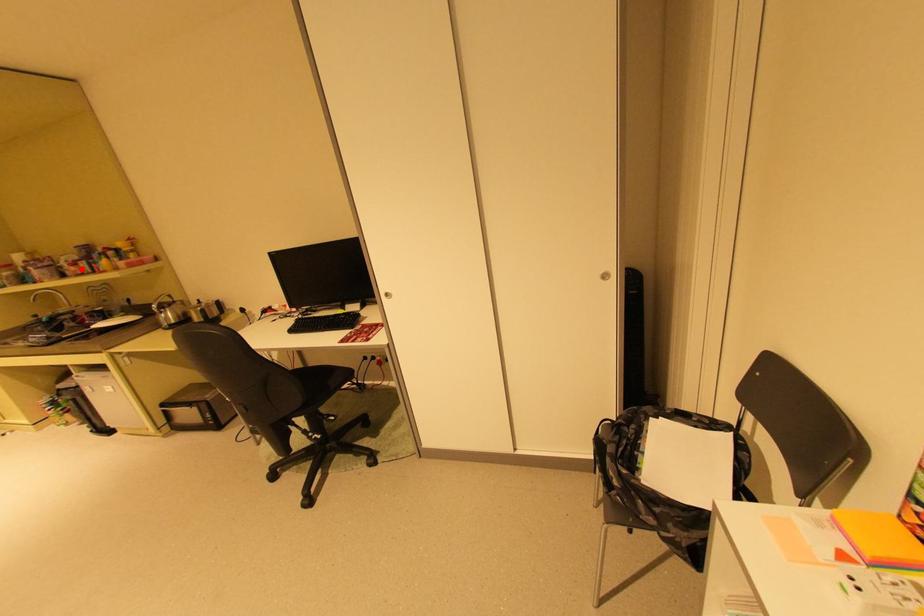
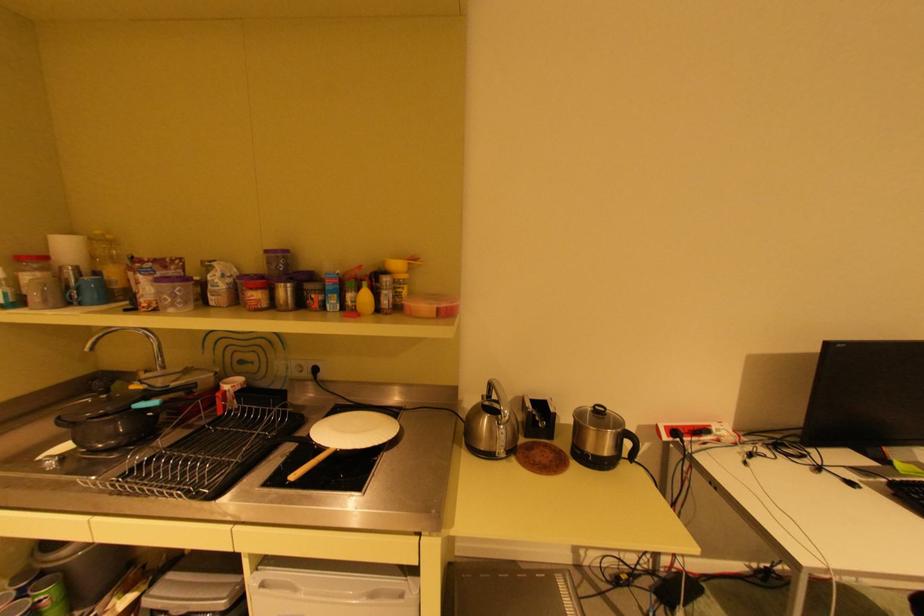
Find the pixel in the second image that matches the highlighted location in the first image.

(264, 294)